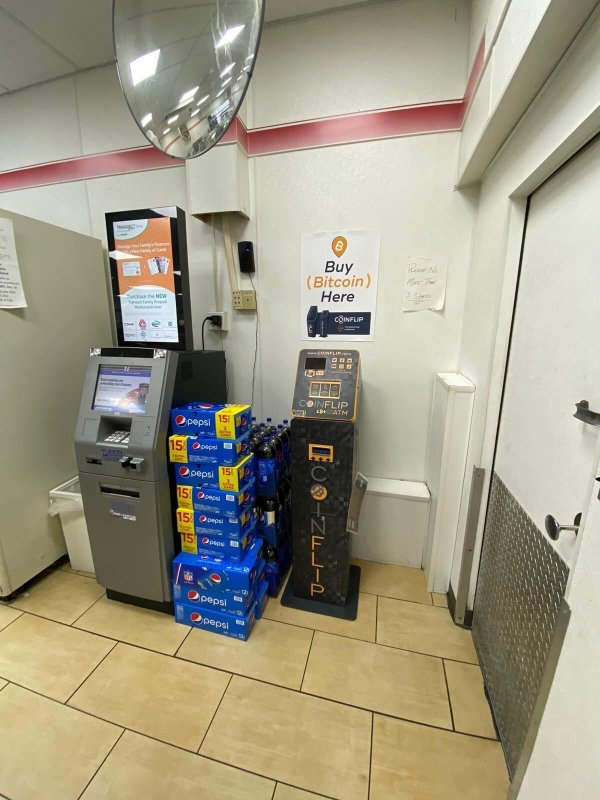
Identify the location of screens. (145, 262), (118, 377), (319, 385).